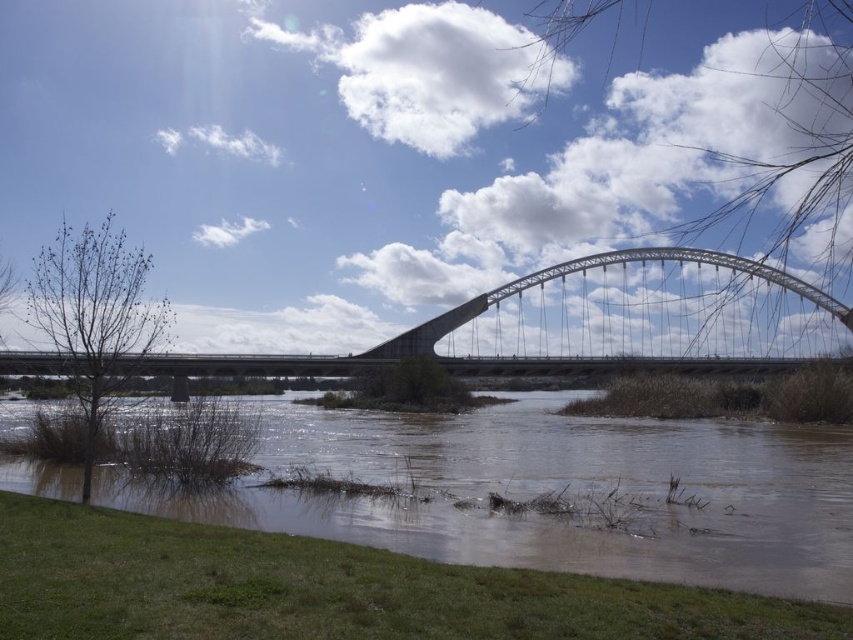
You are planning to cross the river using the bridge. The bridge is the metallic gray arch bridge at center. The river has brown muddy water at lower center. Since the bridge is wider, will you have enough space to cross safely?

The brown muddy water at lower center has a width less than the metallic gray arch bridge at center, so the bridge is wider than the river section here. Therefore, you will have enough space to cross safely on the metallic gray arch bridge at center.

You are standing on the grassy bank and want to cross the river to the other side. The metallic gray arch bridge at center is your only option. However, you notice the brown muddy water at lower center. Is the bridge accessible from your current position, considering the water?

The brown muddy water at lower center is in front of the metallic gray arch bridge at center, so the bridge is behind the water. You can still access the bridge by walking around the muddy water along the bank to reach the bridge structure.